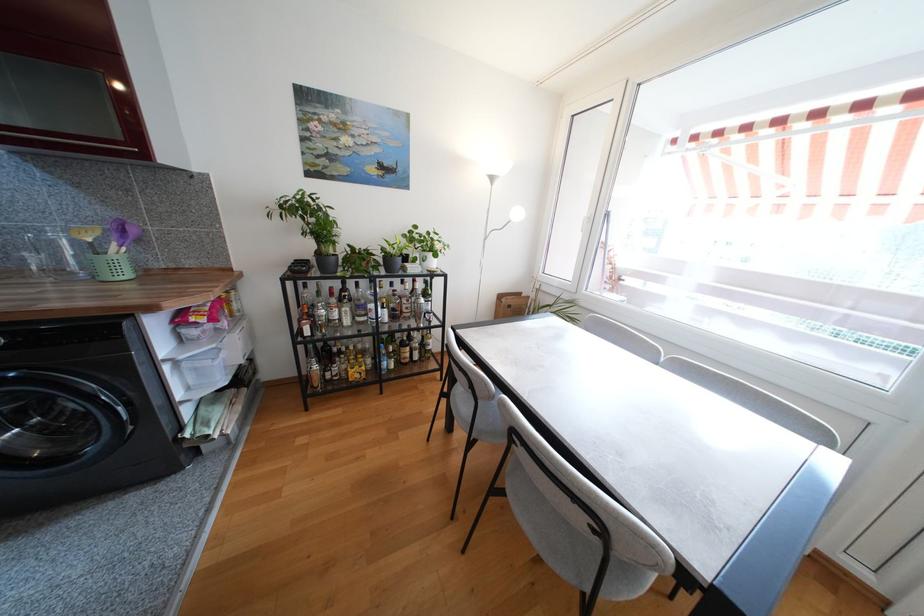
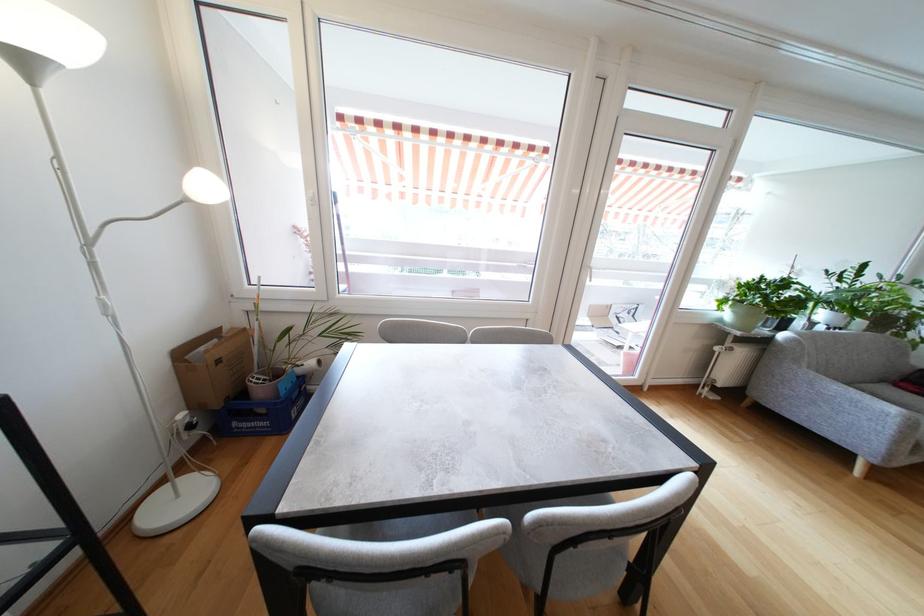
Locate, in the second image, the point that corresponds to (x=591, y=221) in the first image.

(315, 201)